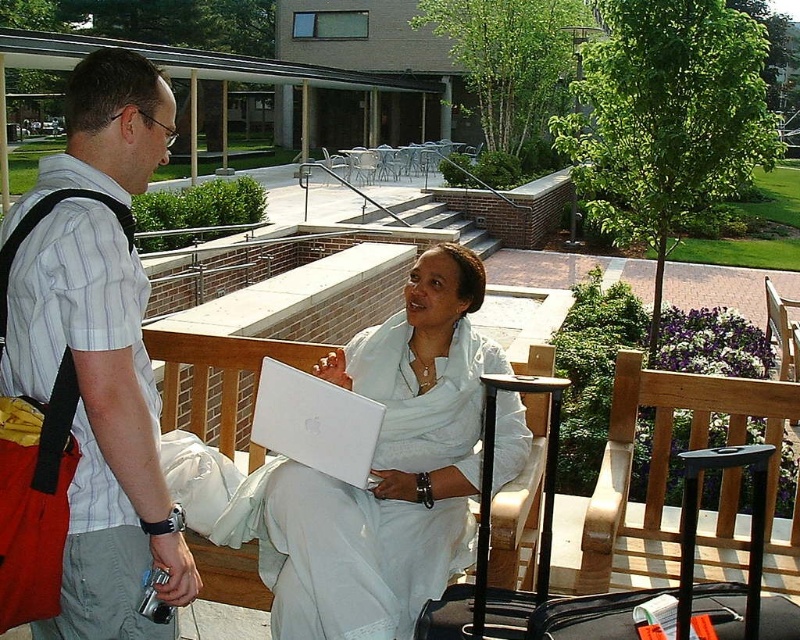
Is white matte laptop at center in front of light brown wooden park bench at center?

Yes, it is.

Is point (392, 497) behind point (766, 435)?

No, it is not.

The height and width of the screenshot is (640, 800). Find the location of `white matte laptop at center`. white matte laptop at center is located at coordinates (384, 472).

Can you confirm if matte black shirt at left is thinner than white matte laptop at center?

Indeed, matte black shirt at left has a lesser width compared to white matte laptop at center.

Where is `matte black shirt at left`? matte black shirt at left is located at coordinates (85, 376).

Does matte black shirt at left have a greater width compared to light brown wooden park bench at center?

No.

Is matte black shirt at left below light brown wooden park bench at center?

No.

At what (x,y) coordinates should I click in order to perform the action: click on matte black shirt at left. Please return your answer as a coordinate pair (x, y). Looking at the image, I should click on (85, 376).

The width and height of the screenshot is (800, 640). Identify the location of matte black shirt at left. (85, 376).